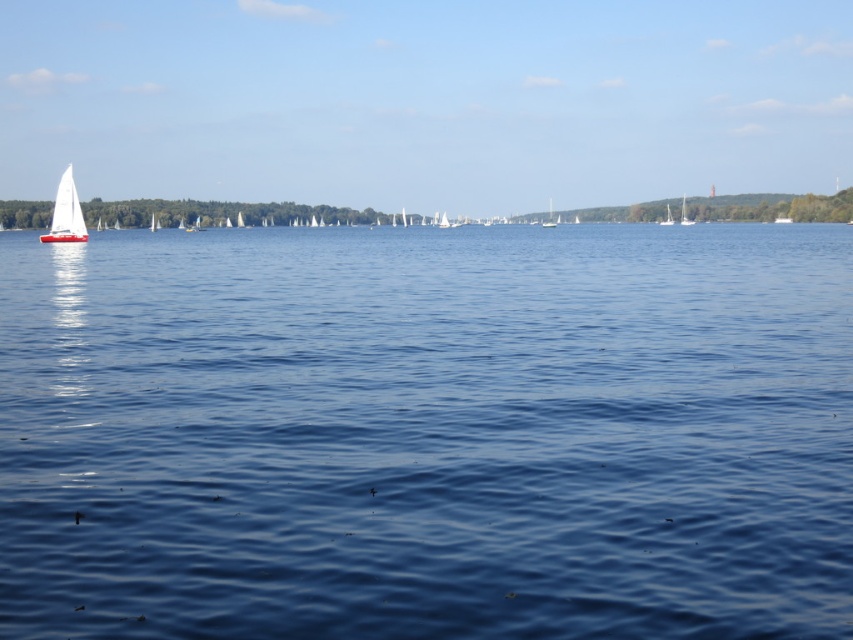
Does white sailboat at center have a greater width compared to white matte sailboat at upper right?

Yes, white sailboat at center is wider than white matte sailboat at upper right.

Who is more forward, (547, 216) or (665, 224)?

Point (665, 224) is in front.

This screenshot has height=640, width=853. Find the location of `white sailboat at center`. white sailboat at center is located at coordinates (549, 218).

Does point (297, 269) come farther from viewer compared to point (67, 208)?

No, it is in front of (67, 208).

Does blue water at center have a greater height compared to white matte sailboat at left?

Correct, blue water at center is much taller as white matte sailboat at left.

Who is more forward, (216, 451) or (67, 195)?

Point (216, 451)

Where is `blue water at center`? The image size is (853, 640). blue water at center is located at coordinates (427, 433).

Is blue water at center wider than white matte sailboat at upper right?

Correct, the width of blue water at center exceeds that of white matte sailboat at upper right.

Is blue water at center thinner than white matte sailboat at upper right?

No.

Where is `blue water at center`? The image size is (853, 640). blue water at center is located at coordinates (427, 433).